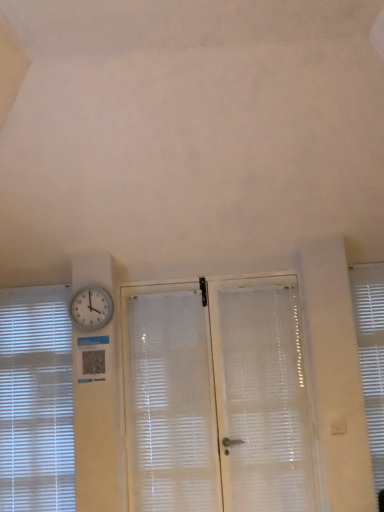
Question: Considering the relative sizes of white frosted glass screen door at center and white translucent blinds at left, the 1th window blind viewed from the left, in the image provided, is white frosted glass screen door at center taller than white translucent blinds at left, the 1th window blind viewed from the left,?

Choices:
 (A) yes
 (B) no

Answer: (A)

Question: Considering the relative sizes of white frosted glass screen door at center and white translucent blinds at left, the 1th window blind viewed from the left, in the image provided, is white frosted glass screen door at center bigger than white translucent blinds at left, the 1th window blind viewed from the left,?

Choices:
 (A) no
 (B) yes

Answer: (B)

Question: Is white frosted glass screen door at center surrounding white translucent blinds at left, which appears as the 2th window blind when viewed from the right?

Choices:
 (A) no
 (B) yes

Answer: (A)

Question: Is white frosted glass screen door at center next to white translucent blinds at left, which appears as the 2th window blind when viewed from the right, and touching it?

Choices:
 (A) yes
 (B) no

Answer: (B)

Question: Can you confirm if white frosted glass screen door at center is thinner than white translucent blinds at left, which appears as the 2th window blind when viewed from the right?

Choices:
 (A) yes
 (B) no

Answer: (A)

Question: Does white frosted glass screen door at center appear on the left side of white translucent blinds at left, the 1th window blind viewed from the left?

Choices:
 (A) yes
 (B) no

Answer: (B)

Question: Considering the relative sizes of white textured window blind at right, the second window blind positioned from the left, and white glossy clock at upper left in the image provided, is white textured window blind at right, the second window blind positioned from the left, shorter than white glossy clock at upper left?

Choices:
 (A) no
 (B) yes

Answer: (A)

Question: Would you say white glossy clock at upper left is part of white textured window blind at right, the 1th window blind viewed from the right,'s contents?

Choices:
 (A) yes
 (B) no

Answer: (B)

Question: Can you confirm if white textured window blind at right, the second window blind positioned from the left, is positioned to the right of white glossy clock at upper left?

Choices:
 (A) yes
 (B) no

Answer: (A)

Question: Is white textured window blind at right, the 1th window blind viewed from the right, to the left of white glossy clock at upper left from the viewer's perspective?

Choices:
 (A) yes
 (B) no

Answer: (B)

Question: Is white textured window blind at right, the 1th window blind viewed from the right, smaller than white glossy clock at upper left?

Choices:
 (A) no
 (B) yes

Answer: (A)

Question: Is white textured window blind at right, the 1th window blind viewed from the right, taller than white glossy clock at upper left?

Choices:
 (A) yes
 (B) no

Answer: (A)

Question: Can you confirm if white frosted glass screen door at center is taller than white translucent shutter at center?

Choices:
 (A) no
 (B) yes

Answer: (B)